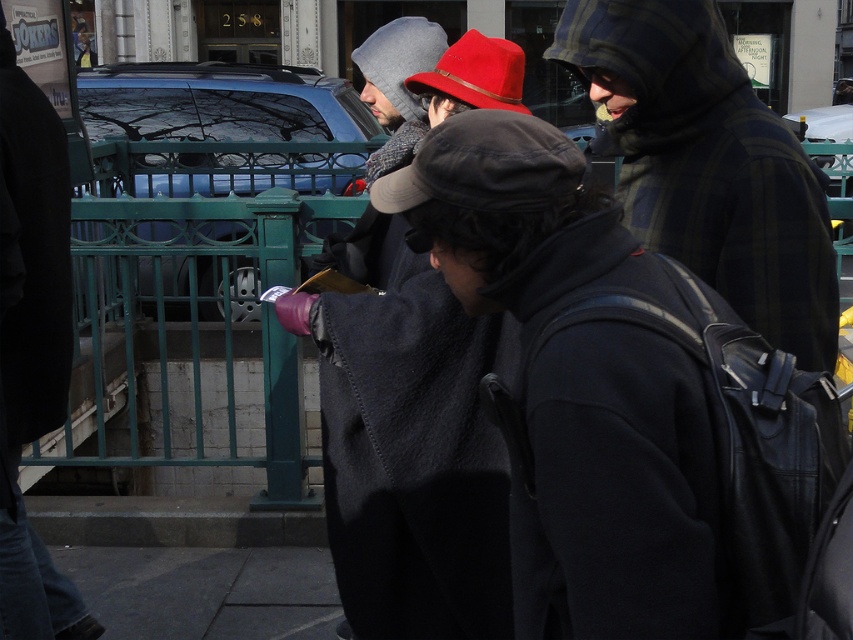
You are standing at the subway entrance and want to walk towards the point labeled as point (x=231, y=557). However, there is an obstacle at point (x=9, y=307). Based on their positions, will you encounter the obstacle before reaching your destination?

Yes, you will encounter the obstacle at point (x=9, y=307) before reaching the destination at point (x=231, y=557) since point (x=9, y=307) is in front of point (x=231, y=557).

You are a delivery person carrying a large box that is 1.2 meters wide. You need to walk through the area shown in the image. Can the matte black coat at center and the dark gray concrete pavement at lower center accommodate your box? Explain why.

The matte black coat at center has a width less than the dark gray concrete pavement at lower center. Since the box is 1.2 meters wide, it can only fit on the dark gray concrete pavement at lower center, which is wider than the matte black coat at center. However, the exact width of the pavement isn not specified, so it depends on whether it is at least 1.2 meters wide.